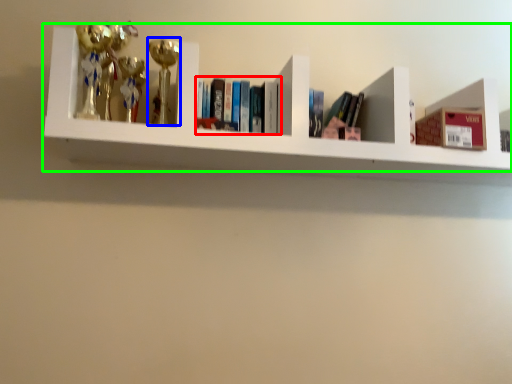
Question: Which object is positioned closest to book (highlighted by a red box)? Select from toy (highlighted by a blue box) and shelf (highlighted by a green box).

Choices:
 (A) toy
 (B) shelf

Answer: (A)